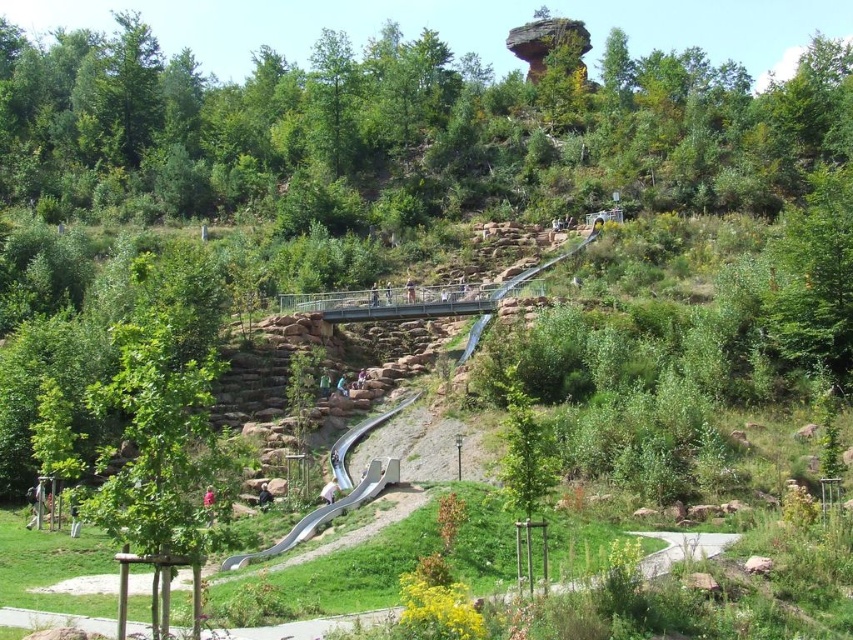
Which is more to the right, green leafy tree at lower left or smooth gray slide at lower center?

From the viewer's perspective, smooth gray slide at lower center appears more on the right side.

At what (x,y) coordinates should I click in order to perform the action: click on green leafy tree at lower left. Please return your answer as a coordinate pair (x, y). Looking at the image, I should click on (157, 451).